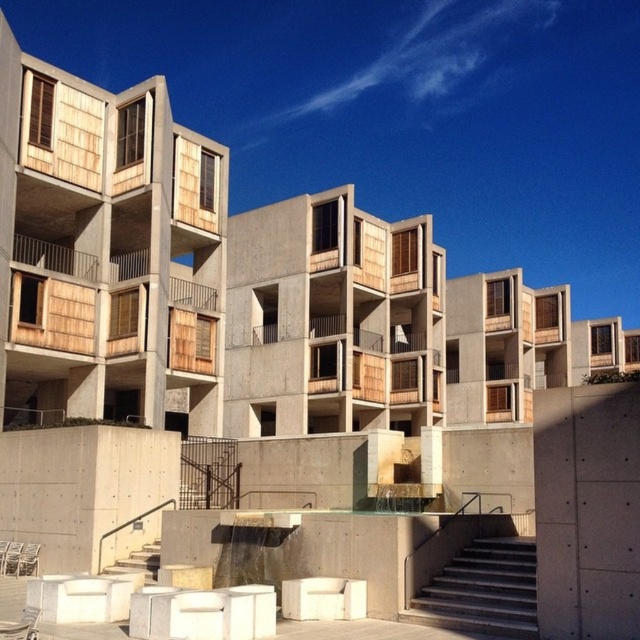
You are standing at the entrance of the modern architectural structure and want to reach the lower basin of the water feature. Based on the image, which direction should you move from the concrete stairs at lower center to reach the water feature?

The concrete stairs at lower center are located at point (483, 589). Since the water feature is in the foreground, you should move downward from the concrete stairs at lower center to reach the water feature.

You are a visitor approaching the building and need to choose between the concrete stairs at lower center and the white concrete stairs at lower left. Which set of stairs is larger in size?

The white concrete stairs at lower left are larger in size compared to the concrete stairs at lower center.